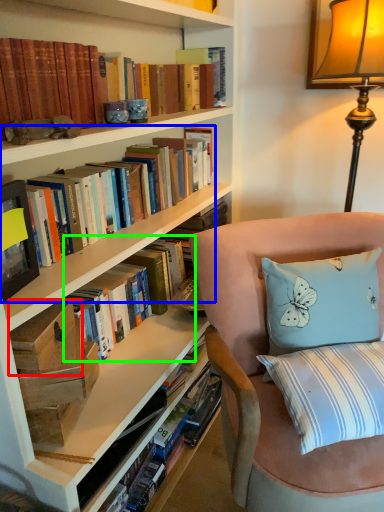
Question: Based on their relative distances, which object is nearer to paperback book (highlighted by a red box)? Choose from book (highlighted by a blue box) and book (highlighted by a green box).

Choices:
 (A) book
 (B) book

Answer: (B)